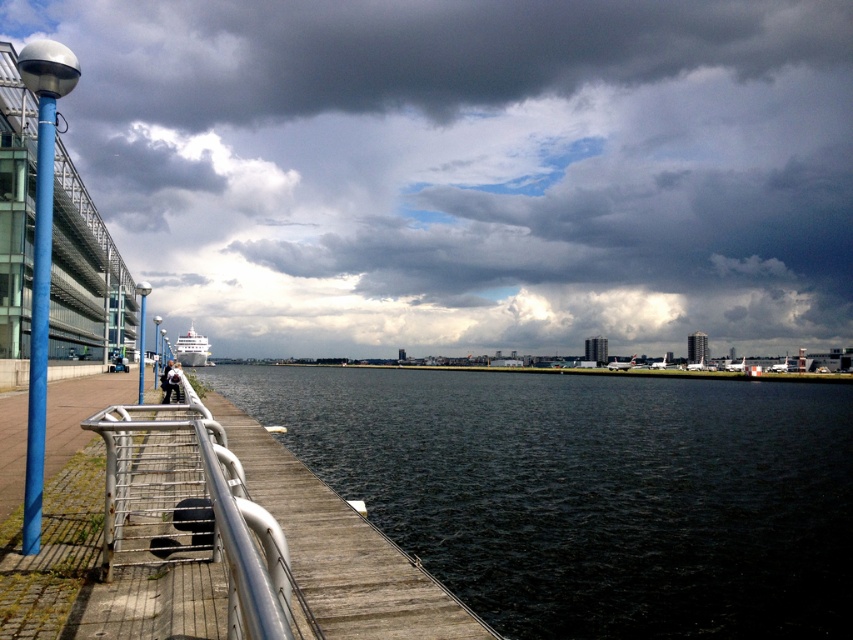
Question: In this image, where is dark water at center located relative to wooden dock at lower left?

Choices:
 (A) left
 (B) right

Answer: (B)

Question: Estimate the real-world distances between objects in this image. Which object is farther from the wooden dock at lower left?

Choices:
 (A) dark water at center
 (B) dark gray cloud at upper center

Answer: (B)

Question: Where is dark water at center located in relation to wooden dock at lower left in the image?

Choices:
 (A) left
 (B) right

Answer: (B)

Question: Which point is farther to the camera?

Choices:
 (A) wooden dock at lower left
 (B) dark water at center
 (C) dark gray cloud at upper center

Answer: (C)

Question: Does dark gray cloud at upper center have a larger size compared to dark water at center?

Choices:
 (A) yes
 (B) no

Answer: (A)

Question: Which object is the farthest from the wooden dock at lower left?

Choices:
 (A) dark water at center
 (B) dark gray cloud at upper center

Answer: (B)